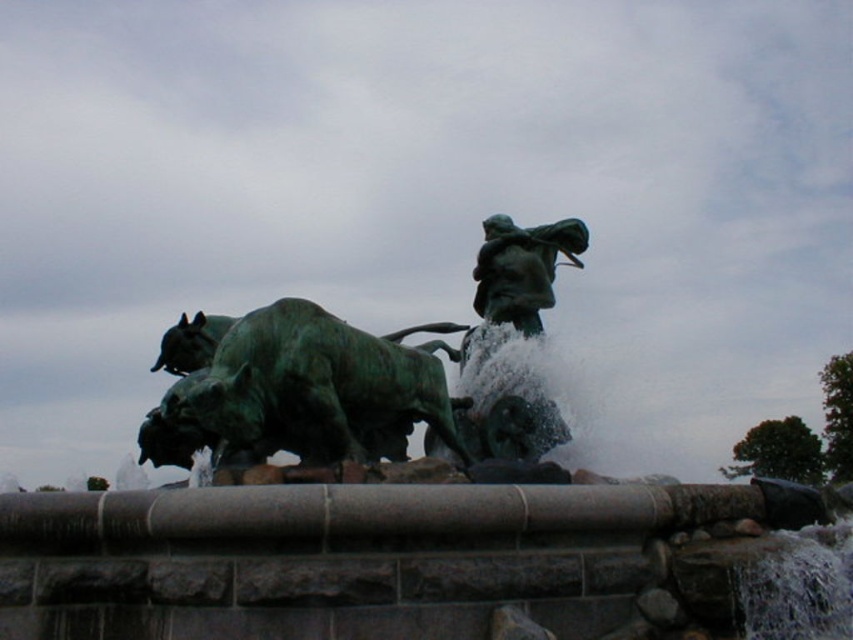
You are an art conservator examining the green patina bronze sculpture at center and the green patina bull at center. Which object is positioned higher in the artwork?

The green patina bronze sculpture at center is located above the green patina bull at center, so it is positioned higher in the artwork.

You are an art curator planning to display both the green patina statue at center and the green patina bronze sculpture at center in a gallery. Given their sizes, which one should be placed in a larger exhibition space to accommodate its dimensions?

The green patina statue at center is larger in size than the green patina bronze sculpture at center, so it should be placed in a larger exhibition space to accommodate its dimensions.

You are an art curator planning to display both the green patina statue at center and the green patina bull at center in a gallery. Given their sizes, which object should be placed on a taller pedestal to ensure proper visibility?

The green patina statue at center should be placed on a taller pedestal because it has a larger size compared to the green patina bull at center, ensuring better visibility for viewers.